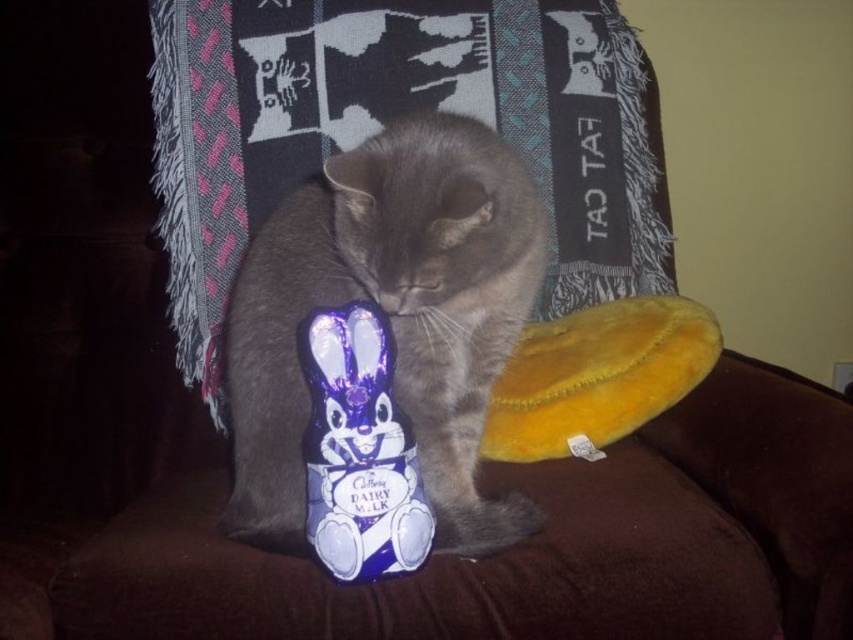
You are a delivery robot that is 0.8 meters wide. You need to move from the point at the bottom left corner to the point at the bottom right corner of the room. The path between the two points is blocked by a gray cat sitting on a dark brown couch. The gray cat is located at point (x=503, y=502). Can you navigate around the cat to reach your destination?

The distance between the delivery robot and the gray cat is 1.11 meters. Since the robot is 0.8 meters wide, it can safely navigate around the cat as the distance allows enough space for maneuvering.

You are a photographer trying to capture the gray cat on the dark brown couch. You notice two points in the image at coordinates point (300, 548) and point (318, 545). Which point is closer to the camera?

Point (318, 545) is closer to the camera because point (300, 548) is behind it.

What is the object located at the coordinates point (390, 316)?

The object located at point (390, 316) is the gray fur cat at center.